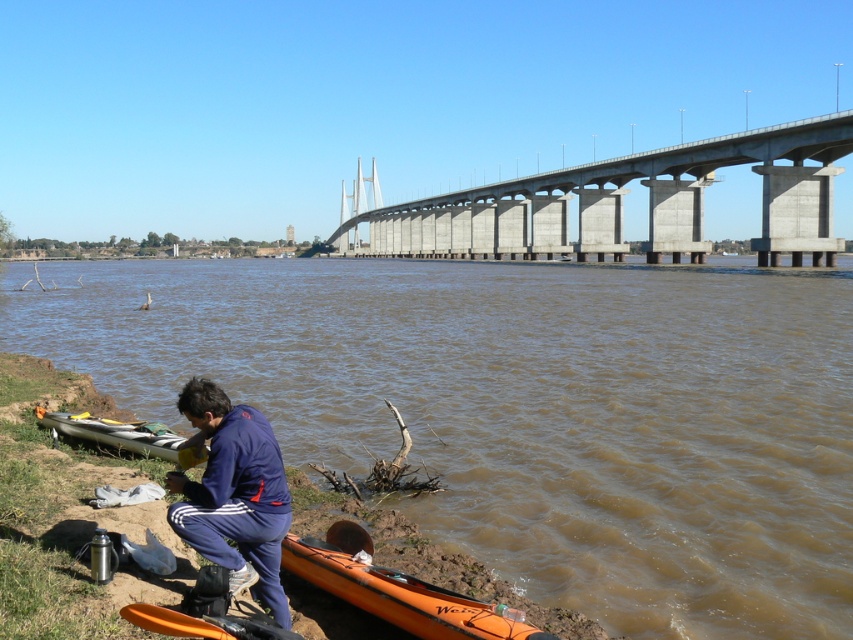
Between point (486, 234) and point (74, 428), which one is positioned behind?

The point (486, 234) is more distant.

From the picture: Between concrete bridge at upper center and gray matte canoe at lower left, which one has more height?

concrete bridge at upper center

Who is more forward, (641,172) or (164,456)?

Positioned in front is point (164,456).

Find the location of a particular element. The height and width of the screenshot is (640, 853). concrete bridge at upper center is located at coordinates [x=621, y=202].

Which is below, concrete bridge at upper center or orange plastic kayak at lower center?

orange plastic kayak at lower center is below.

Is concrete bridge at upper center bigger than orange plastic kayak at lower center?

Indeed, concrete bridge at upper center has a larger size compared to orange plastic kayak at lower center.

Does point (399, 241) lie in front of point (433, 593)?

No, it is not.

At what (x,y) coordinates should I click in order to perform the action: click on concrete bridge at upper center. Please return your answer as a coordinate pair (x, y). This screenshot has width=853, height=640. Looking at the image, I should click on (621, 202).

In the scene shown: Does brown muddy water at lower center have a smaller size compared to gray matte canoe at lower left?

No, brown muddy water at lower center is not smaller than gray matte canoe at lower left.

Who is taller, brown muddy water at lower center or gray matte canoe at lower left?

With more height is brown muddy water at lower center.

Which is in front, point (517, 422) or point (71, 416)?

Point (71, 416)

Locate an element on the screen. The width and height of the screenshot is (853, 640). brown muddy water at lower center is located at coordinates (x=526, y=410).